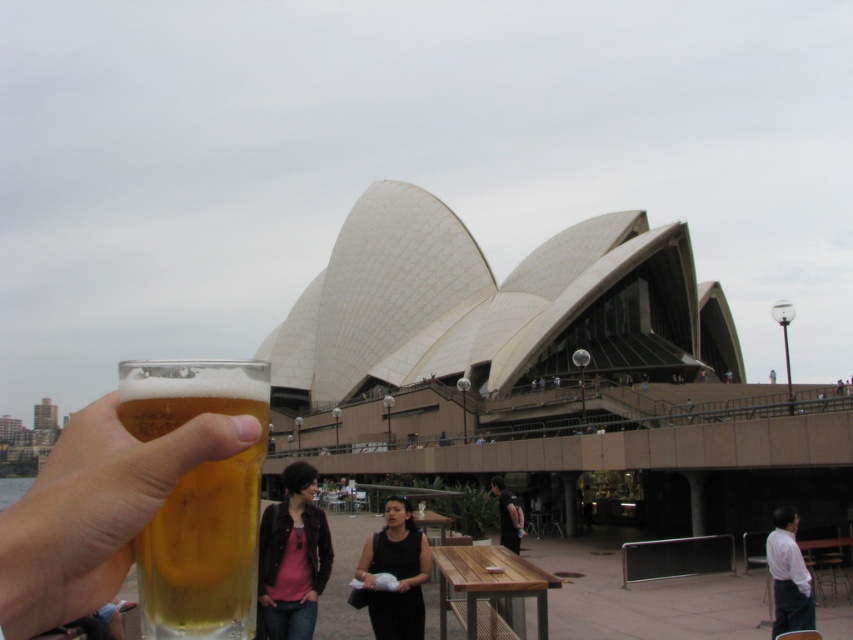
Who is positioned more to the left, white shirt at lower right or dark gray fabric jacket at center?

Positioned to the left is dark gray fabric jacket at center.

Between point (778, 547) and point (514, 508), which one is positioned in front?

Point (778, 547) is in front.

The image size is (853, 640). In order to click on white shirt at lower right in this screenshot , I will do `click(788, 576)`.

Does black fabric dress at center have a greater height compared to dark gray fabric jacket at center?

Correct, black fabric dress at center is much taller as dark gray fabric jacket at center.

Is point (373, 547) positioned in front of point (518, 547)?

That is True.

Locate an element on the screen. black fabric dress at center is located at coordinates (395, 573).

Who is positioned more to the left, matte black jacket at center or black fabric dress at center?

From the viewer's perspective, matte black jacket at center appears more on the left side.

Which is in front, point (309, 550) or point (393, 618)?

Point (393, 618)

Between point (303, 497) and point (379, 616), which one is positioned in front?

Positioned in front is point (379, 616).

Identify the location of matte black jacket at center. (292, 557).